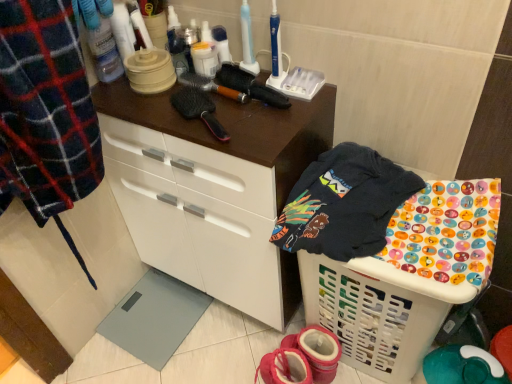
Question: Is pink fabric booties at lower center oriented away from white plastic laundry basket at lower right?

Choices:
 (A) yes
 (B) no

Answer: (B)

Question: Is pink fabric booties at lower center taller than white plastic laundry basket at lower right?

Choices:
 (A) no
 (B) yes

Answer: (A)

Question: Is pink fabric booties at lower center further to camera compared to white plastic laundry basket at lower right?

Choices:
 (A) no
 (B) yes

Answer: (B)

Question: Is pink fabric booties at lower center outside of white plastic laundry basket at lower right?

Choices:
 (A) no
 (B) yes

Answer: (B)

Question: Is pink fabric booties at lower center thinner than white plastic laundry basket at lower right?

Choices:
 (A) no
 (B) yes

Answer: (B)

Question: Is pink fabric booties at lower center bigger than white plastic laundry basket at lower right?

Choices:
 (A) yes
 (B) no

Answer: (B)

Question: Considering the relative sizes of white plastic laundry basket at lower right and pink fabric booties at lower center in the image provided, is white plastic laundry basket at lower right taller than pink fabric booties at lower center?

Choices:
 (A) no
 (B) yes

Answer: (B)

Question: Is the depth of white plastic laundry basket at lower right greater than that of pink fabric booties at lower center?

Choices:
 (A) yes
 (B) no

Answer: (B)

Question: Is white plastic laundry basket at lower right smaller than pink fabric booties at lower center?

Choices:
 (A) yes
 (B) no

Answer: (B)

Question: From a real-world perspective, is white plastic laundry basket at lower right positioned under pink fabric booties at lower center based on gravity?

Choices:
 (A) no
 (B) yes

Answer: (A)

Question: Considering the relative sizes of white plastic laundry basket at lower right and pink fabric booties at lower center in the image provided, is white plastic laundry basket at lower right wider than pink fabric booties at lower center?

Choices:
 (A) no
 (B) yes

Answer: (B)

Question: Is white plastic laundry basket at lower right turned away from pink fabric booties at lower center?

Choices:
 (A) yes
 (B) no

Answer: (B)

Question: From a real-world perspective, is black synthetic hairbrush at upper center on pink fabric booties at lower center?

Choices:
 (A) yes
 (B) no

Answer: (A)